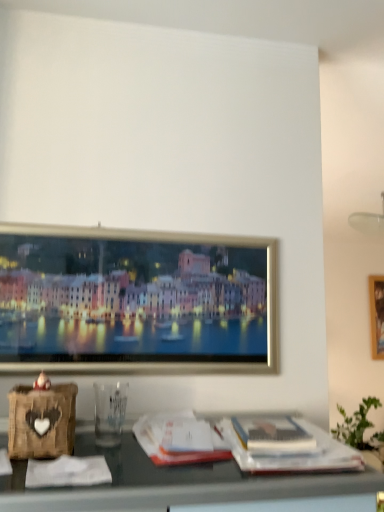
Identify the location of matte white magazine at lower right, the first magazine viewed from the right. The height and width of the screenshot is (512, 384). (272, 434).

What do you see at coordinates (272, 434) in the screenshot? The width and height of the screenshot is (384, 512). I see `matte white magazine at lower right, which is the 2th magazine in left-to-right order` at bounding box center [272, 434].

You are a GUI agent. You are given a task and a screenshot of the screen. Output one action in this format:
    pyautogui.click(x=<x>, y=<y>)
    Task: Click on the white paper magazine at center, the first magazine viewed from the left
    The width and height of the screenshot is (384, 512).
    Given the screenshot: What is the action you would take?
    pyautogui.click(x=180, y=439)

What do you see at coordinates (180, 439) in the screenshot? I see `white paper magazine at center, which is counted as the second magazine, starting from the right` at bounding box center [180, 439].

From the picture: How much space does white paper magazine at center, which is counted as the second magazine, starting from the right, occupy horizontally?

It is 28.02 centimeters.

Locate an element on the screen. matte white magazine at lower right, which is the 2th magazine in left-to-right order is located at coordinates (272, 434).

Between white paper magazine at center, which is counted as the second magazine, starting from the right, and matte white magazine at lower right, which is the 2th magazine in left-to-right order, which one appears on the left side from the viewer's perspective?

Positioned to the left is white paper magazine at center, which is counted as the second magazine, starting from the right.

Which object is closer to the camera, white paper magazine at center, the first magazine viewed from the left, or matte white magazine at lower right, which is the 2th magazine in left-to-right order?

white paper magazine at center, the first magazine viewed from the left.

Is point (158, 417) closer or farther from the camera than point (303, 435)?

Point (158, 417) is farther from the camera than point (303, 435).

From the image's perspective, is white paper magazine at center, the first magazine viewed from the left, located beneath matte white magazine at lower right, which is the 2th magazine in left-to-right order?

Indeed, from the image's perspective, white paper magazine at center, the first magazine viewed from the left, is shown beneath matte white magazine at lower right, which is the 2th magazine in left-to-right order.

From a real-world perspective, relative to matte white magazine at lower right, the first magazine viewed from the right, is white paper magazine at center, the first magazine viewed from the left, vertically above or below?

Clearly, from a real-world perspective, white paper magazine at center, the first magazine viewed from the left, is below matte white magazine at lower right, the first magazine viewed from the right.

Between white paper magazine at center, the first magazine viewed from the left, and matte white magazine at lower right, the first magazine viewed from the right, which one has larger width?

With larger width is white paper magazine at center, the first magazine viewed from the left.

Does white paper magazine at center, the first magazine viewed from the left, have a lesser height compared to matte white magazine at lower right, the first magazine viewed from the right?

No, white paper magazine at center, the first magazine viewed from the left, is not shorter than matte white magazine at lower right, the first magazine viewed from the right.

Which of these two, white paper magazine at center, the first magazine viewed from the left, or matte white magazine at lower right, which is the 2th magazine in left-to-right order, is bigger?

white paper magazine at center, the first magazine viewed from the left, is bigger.

Is white paper magazine at center, which is counted as the second magazine, starting from the right, positioned beyond the bounds of matte white magazine at lower right, the first magazine viewed from the right?

Indeed, white paper magazine at center, which is counted as the second magazine, starting from the right, is completely outside matte white magazine at lower right, the first magazine viewed from the right.

Can you see white paper magazine at center, the first magazine viewed from the left, touching matte white magazine at lower right, the first magazine viewed from the right?

No, white paper magazine at center, the first magazine viewed from the left, is not making contact with matte white magazine at lower right, the first magazine viewed from the right.

In the scene shown: Is white paper magazine at center, the first magazine viewed from the left, aimed at matte white magazine at lower right, which is the 2th magazine in left-to-right order?

No, white paper magazine at center, the first magazine viewed from the left, is not facing towards matte white magazine at lower right, which is the 2th magazine in left-to-right order.

What's the angular difference between white paper magazine at center, the first magazine viewed from the left, and matte white magazine at lower right, the first magazine viewed from the right,'s facing directions?

There is a 2.3-degree angle between the facing directions of white paper magazine at center, the first magazine viewed from the left, and matte white magazine at lower right, the first magazine viewed from the right.

The height and width of the screenshot is (512, 384). Find the location of `magazine below the matte white magazine at lower right, the first magazine viewed from the right (from the image's perspective)`. magazine below the matte white magazine at lower right, the first magazine viewed from the right (from the image's perspective) is located at coordinates (180, 439).

Which is more to the left, matte white magazine at lower right, which is the 2th magazine in left-to-right order, or white paper magazine at center, the first magazine viewed from the left?

From the viewer's perspective, white paper magazine at center, the first magazine viewed from the left, appears more on the left side.

Relative to white paper magazine at center, which is counted as the second magazine, starting from the right, is matte white magazine at lower right, which is the 2th magazine in left-to-right order, in front or behind?

In the image, matte white magazine at lower right, which is the 2th magazine in left-to-right order, appears behind white paper magazine at center, which is counted as the second magazine, starting from the right.

Between point (265, 444) and point (182, 425), which one is positioned behind?

The point (182, 425) is behind.

From the image's perspective, is matte white magazine at lower right, which is the 2th magazine in left-to-right order, under white paper magazine at center, which is counted as the second magazine, starting from the right?

No, from the image's perspective, matte white magazine at lower right, which is the 2th magazine in left-to-right order, is not beneath white paper magazine at center, which is counted as the second magazine, starting from the right.

From a real-world perspective, does matte white magazine at lower right, which is the 2th magazine in left-to-right order, sit lower than white paper magazine at center, the first magazine viewed from the left?

No, from a real-world perspective, matte white magazine at lower right, which is the 2th magazine in left-to-right order, is not under white paper magazine at center, the first magazine viewed from the left.

Does matte white magazine at lower right, which is the 2th magazine in left-to-right order, have a greater width compared to white paper magazine at center, which is counted as the second magazine, starting from the right?

Incorrect, the width of matte white magazine at lower right, which is the 2th magazine in left-to-right order, does not surpass that of white paper magazine at center, which is counted as the second magazine, starting from the right.

Based on the photo, considering the relative sizes of matte white magazine at lower right, which is the 2th magazine in left-to-right order, and white paper magazine at center, which is counted as the second magazine, starting from the right, in the image provided, is matte white magazine at lower right, which is the 2th magazine in left-to-right order, shorter than white paper magazine at center, which is counted as the second magazine, starting from the right,?

Yes, matte white magazine at lower right, which is the 2th magazine in left-to-right order, is shorter than white paper magazine at center, which is counted as the second magazine, starting from the right.

Based on their sizes in the image, would you say matte white magazine at lower right, which is the 2th magazine in left-to-right order, is bigger or smaller than white paper magazine at center, the first magazine viewed from the left?

Clearly, matte white magazine at lower right, which is the 2th magazine in left-to-right order, is smaller in size than white paper magazine at center, the first magazine viewed from the left.

Do you think matte white magazine at lower right, the first magazine viewed from the right, is within white paper magazine at center, the first magazine viewed from the left, or outside of it?

matte white magazine at lower right, the first magazine viewed from the right, is located beyond the bounds of white paper magazine at center, the first magazine viewed from the left.

Are matte white magazine at lower right, the first magazine viewed from the right, and white paper magazine at center, the first magazine viewed from the left, beside each other?

There is a gap between matte white magazine at lower right, the first magazine viewed from the right, and white paper magazine at center, the first magazine viewed from the left.

Based on the photo, could you tell me if matte white magazine at lower right, which is the 2th magazine in left-to-right order, is turned towards white paper magazine at center, the first magazine viewed from the left?

No, matte white magazine at lower right, which is the 2th magazine in left-to-right order, is not turned towards white paper magazine at center, the first magazine viewed from the left.

At what (x,y) coordinates should I click in order to perform the action: click on magazine that appears on the left of matte white magazine at lower right, which is the 2th magazine in left-to-right order. Please return your answer as a coordinate pair (x, y). Looking at the image, I should click on (180, 439).

This screenshot has width=384, height=512. In order to click on magazine above the white paper magazine at center, which is counted as the second magazine, starting from the right (from the image's perspective) in this screenshot , I will do `click(272, 434)`.

At what (x,y) coordinates should I click in order to perform the action: click on magazine in front of the matte white magazine at lower right, the first magazine viewed from the right. Please return your answer as a coordinate pair (x, y). The image size is (384, 512). Looking at the image, I should click on (180, 439).